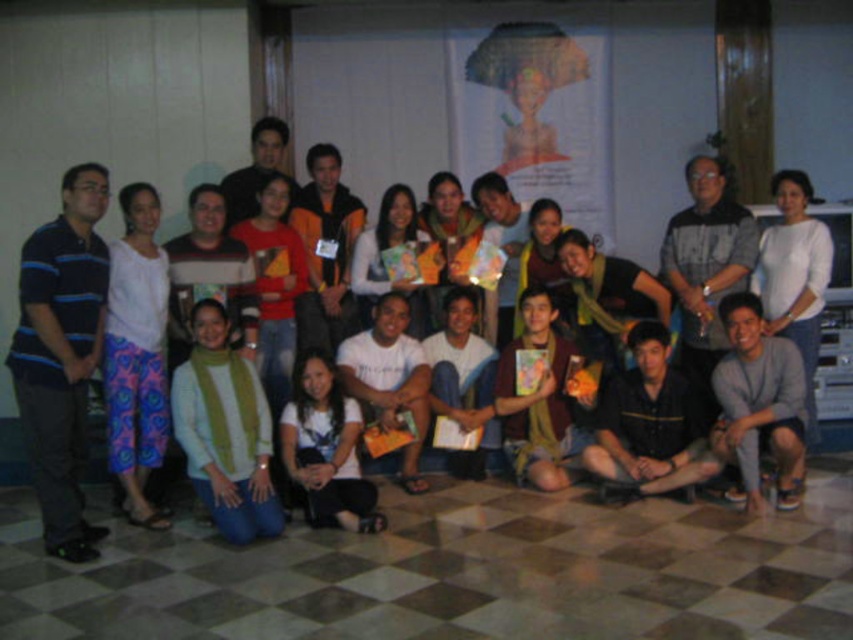
Does green knitted sweater at lower left appear on the right side of black textured shirt at center?

In fact, green knitted sweater at lower left is to the left of black textured shirt at center.

Who is higher up, green knitted sweater at lower left or black textured shirt at center?

Positioned higher is black textured shirt at center.

Does point (202, 404) come closer to viewer compared to point (695, 179)?

Yes, point (202, 404) is in front of point (695, 179).

Where is `green knitted sweater at lower left`? Image resolution: width=853 pixels, height=640 pixels. green knitted sweater at lower left is located at coordinates coord(225,429).

Who is positioned more to the right, white matte shirt at lower center or white matte shirt at upper right?

white matte shirt at upper right

Who is shorter, white matte shirt at lower center or white matte shirt at upper right?

With less height is white matte shirt at lower center.

Image resolution: width=853 pixels, height=640 pixels. What do you see at coordinates (326, 449) in the screenshot? I see `white matte shirt at lower center` at bounding box center [326, 449].

Where is `white matte shirt at lower center`? white matte shirt at lower center is located at coordinates (326, 449).

Looking at this image, can you confirm if blue printed pants at left is positioned to the left of white matte shirt at upper right?

Indeed, blue printed pants at left is positioned on the left side of white matte shirt at upper right.

Who is taller, blue printed pants at left or white matte shirt at upper right?

blue printed pants at left is taller.

Where is `blue printed pants at left`? This screenshot has height=640, width=853. blue printed pants at left is located at coordinates (136, 353).